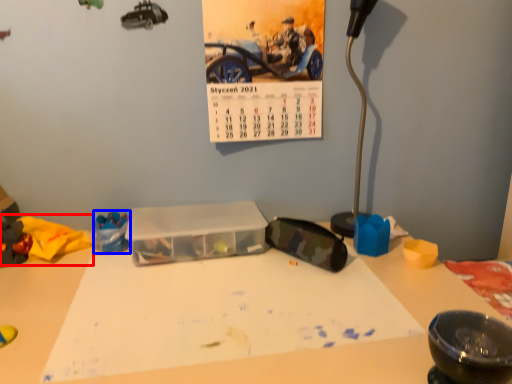
Question: Which of the following is the closest to the observer, toy (highlighted by a red box) or toy (highlighted by a blue box)?

Choices:
 (A) toy
 (B) toy

Answer: (A)